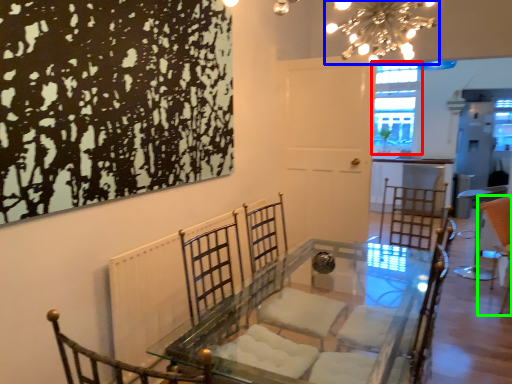
Question: Considering the real-world distances, which object is closest to window (highlighted by a red box)? light fixture (highlighted by a blue box) or swivel chair (highlighted by a green box).

Choices:
 (A) light fixture
 (B) swivel chair

Answer: (B)